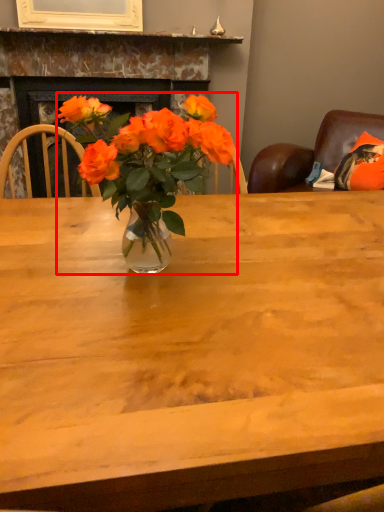
Question: Where is houseplant (annotated by the red box) located in relation to fireplace in the image?

Choices:
 (A) right
 (B) left

Answer: (A)